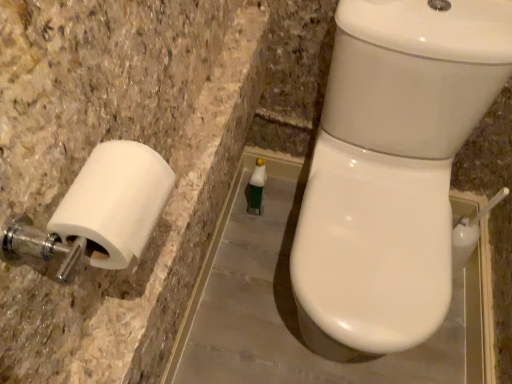
Question: Is green matte bottle at center taller than white glossy toilet at right?

Choices:
 (A) yes
 (B) no

Answer: (B)

Question: Considering the relative sizes of green matte bottle at center and white glossy toilet at right in the image provided, is green matte bottle at center shorter than white glossy toilet at right?

Choices:
 (A) yes
 (B) no

Answer: (A)

Question: From the image's perspective, is green matte bottle at center on top of white glossy toilet at right?

Choices:
 (A) no
 (B) yes

Answer: (B)

Question: Considering the relative sizes of green matte bottle at center and white glossy toilet at right in the image provided, is green matte bottle at center smaller than white glossy toilet at right?

Choices:
 (A) yes
 (B) no

Answer: (A)

Question: Is green matte bottle at center positioned with its back to white glossy toilet at right?

Choices:
 (A) no
 (B) yes

Answer: (A)

Question: Is green matte bottle at center in front of or behind white glossy toilet at right in the image?

Choices:
 (A) behind
 (B) front

Answer: (A)

Question: Is green matte bottle at center situated inside white glossy toilet at right or outside?

Choices:
 (A) inside
 (B) outside

Answer: (B)

Question: Is point (262, 178) closer or farther from the camera than point (329, 223)?

Choices:
 (A) closer
 (B) farther

Answer: (B)

Question: From a real-world perspective, is green matte bottle at center positioned above or below white glossy toilet at right?

Choices:
 (A) below
 (B) above

Answer: (A)

Question: Considering the relative positions of green matte bottle at center and white matte toilet paper at left in the image provided, is green matte bottle at center to the left or to the right of white matte toilet paper at left?

Choices:
 (A) left
 (B) right

Answer: (B)

Question: From the image's perspective, relative to white matte toilet paper at left, is green matte bottle at center above or below?

Choices:
 (A) below
 (B) above

Answer: (B)

Question: In terms of size, does green matte bottle at center appear bigger or smaller than white matte toilet paper at left?

Choices:
 (A) big
 (B) small

Answer: (B)

Question: Considering the positions of green matte bottle at center and white matte toilet paper at left in the image, is green matte bottle at center wider or thinner than white matte toilet paper at left?

Choices:
 (A) wide
 (B) thin

Answer: (B)

Question: From the image's perspective, is white matte toilet paper at left positioned above or below white glossy toilet at right?

Choices:
 (A) below
 (B) above

Answer: (A)

Question: In terms of height, does white matte toilet paper at left look taller or shorter compared to white glossy toilet at right?

Choices:
 (A) short
 (B) tall

Answer: (A)